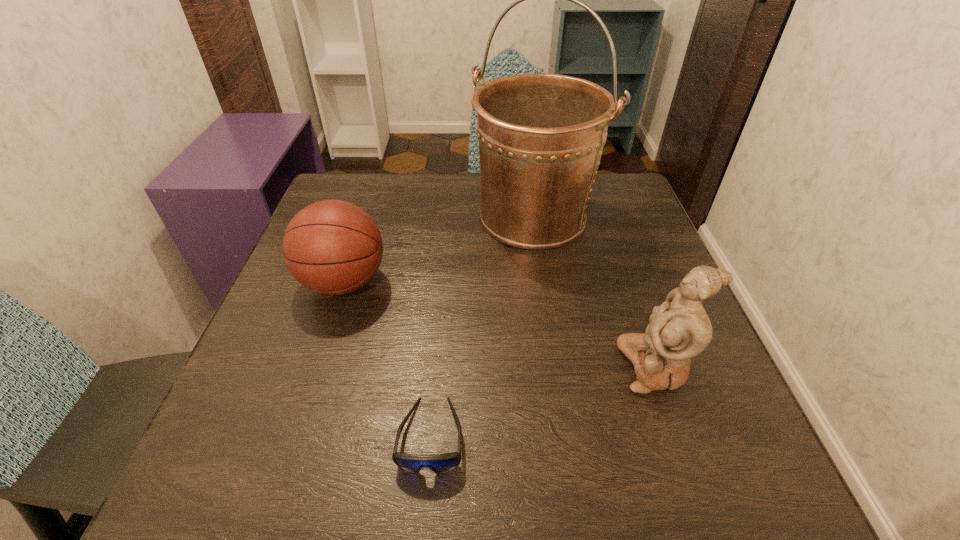
In order to click on free area in between the bucket and the shortest object in this screenshot , I will do `click(482, 326)`.

Identify the location of vacant region between the nearest object and the tallest object. Image resolution: width=960 pixels, height=540 pixels. (482, 326).

Identify the location of free point between the second shortest object and the figurine. (499, 325).

Select which object is the second closest to the bucket. Please provide its 2D coordinates. Your answer should be formatted as a tuple, i.e. [(x, y)], where the tuple contains the x and y coordinates of a point satisfying the conditions above.

[(679, 329)]

Locate which object is the second closest to the basketball. Please provide its 2D coordinates. Your answer should be formatted as a tuple, i.e. [(x, y)], where the tuple contains the x and y coordinates of a point satisfying the conditions above.

[(440, 463)]

This screenshot has width=960, height=540. In order to click on free point that satisfies the following two spatial constraints: 1. on the front-facing side of the figurine; 2. on the front-facing side of the sunglasses in this screenshot , I will do `click(679, 435)`.

Locate an element on the screen. This screenshot has width=960, height=540. free space that satisfies the following two spatial constraints: 1. on the front-facing side of the second nearest object; 2. on the front-facing side of the sunglasses is located at coordinates (679, 435).